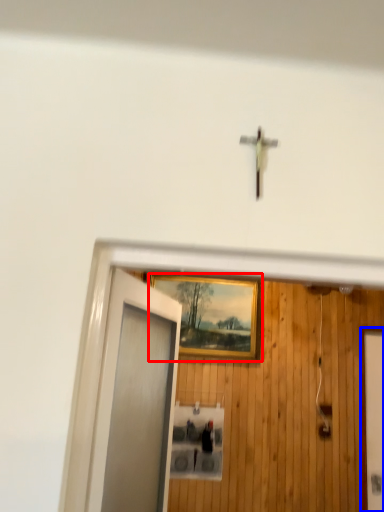
Question: Among these objects, which one is nearest to the camera, picture frame (highlighted by a red box) or elevator door (highlighted by a blue box)?

Choices:
 (A) picture frame
 (B) elevator door

Answer: (B)